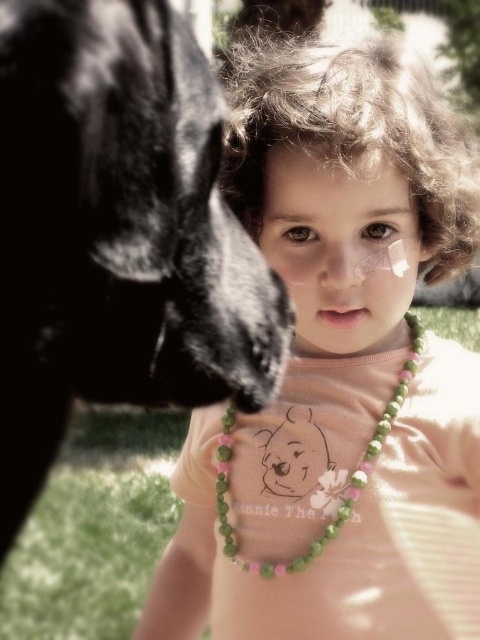
Who is higher up, pink matte necklace at upper center or matte skin nose at center?

matte skin nose at center is above.

Which is more to the left, pink matte necklace at upper center or matte skin nose at center?

Positioned to the left is pink matte necklace at upper center.

Where is `pink matte necklace at upper center`? The width and height of the screenshot is (480, 640). pink matte necklace at upper center is located at coordinates (320, 256).

I want to click on pink matte necklace at upper center, so click(x=320, y=256).

Can you confirm if black fur dog at left is taller than matte skin nose at center?

Indeed, black fur dog at left has a greater height compared to matte skin nose at center.

Is black fur dog at left to the left of matte skin nose at center from the viewer's perspective?

Correct, you'll find black fur dog at left to the left of matte skin nose at center.

Who is more distant from viewer, (4, 445) or (333, 282)?

The point (333, 282) is more distant.

In order to click on black fur dog at left in this screenshot , I will do `click(118, 232)`.

Is the position of pink matte necklace at upper center more distant than that of black fur dog at left?

Yes, it is behind black fur dog at left.

Describe the element at coordinates (320, 256) in the screenshot. The width and height of the screenshot is (480, 640). I see `pink matte necklace at upper center` at that location.

Is point (338, 186) positioned in front of point (10, 148)?

No.

I want to click on pink matte necklace at upper center, so click(x=320, y=256).